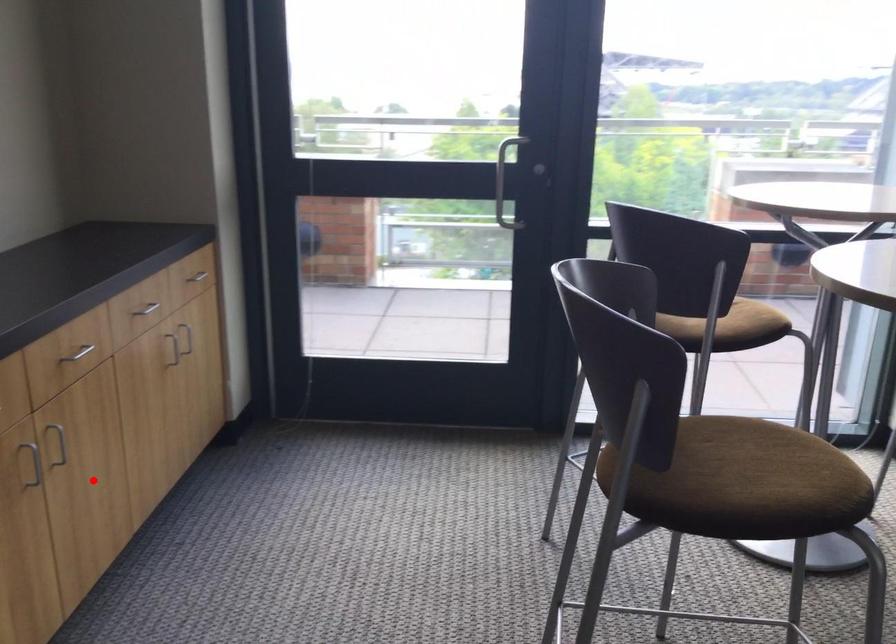
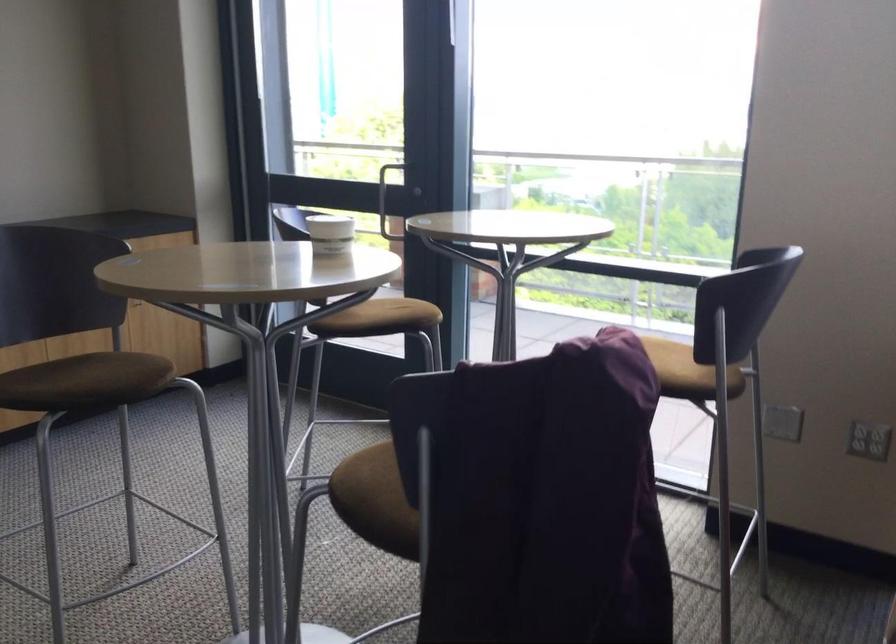
Locate, in the second image, the point that corresponds to the highlighted location in the first image.

(76, 344)